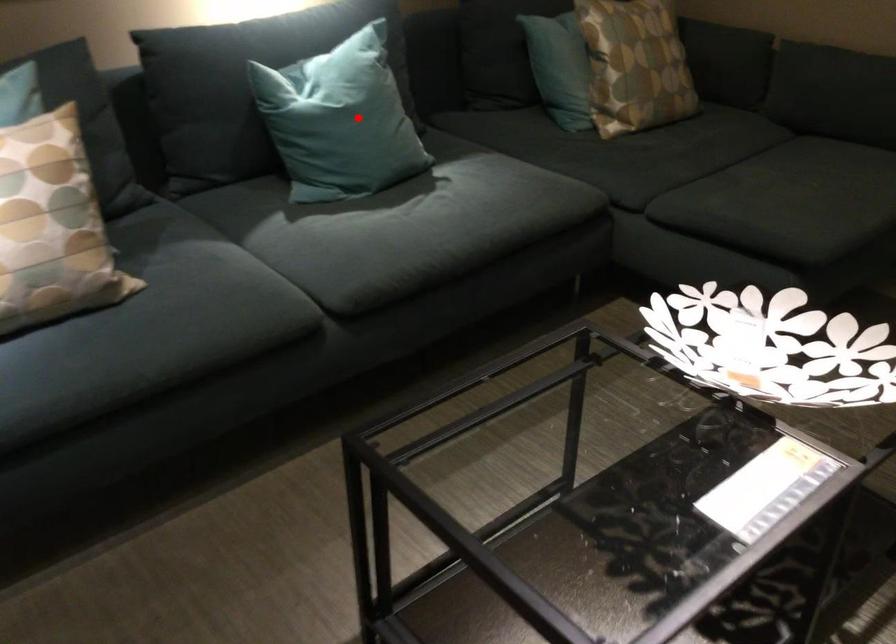
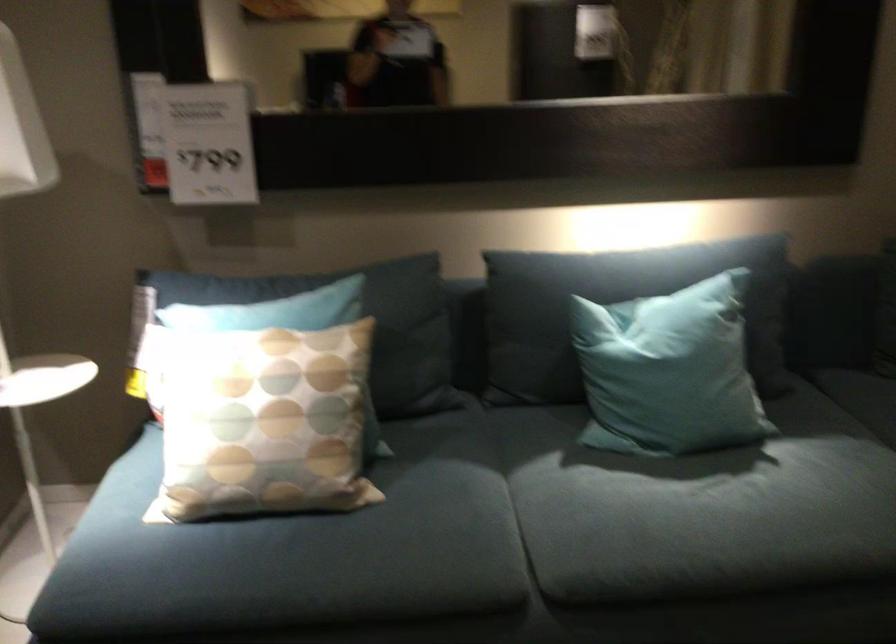
Where in the second image is the point corresponding to the highlighted location from the first image?

(668, 371)